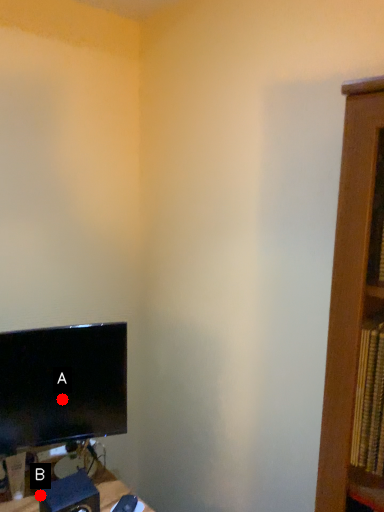
Question: Two points are circled on the image, labeled by A and B beside each circle. Which of the following is the farthest from the observer?

Choices:
 (A) A is further
 (B) B is further

Answer: (A)